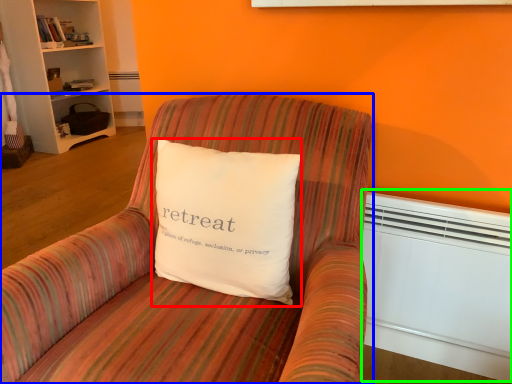
Question: Estimate the real-world distances between objects in this image. Which object is farther from pillow (highlighted by a red box), chair (highlighted by a blue box) or heater (highlighted by a green box)?

Choices:
 (A) chair
 (B) heater

Answer: (B)